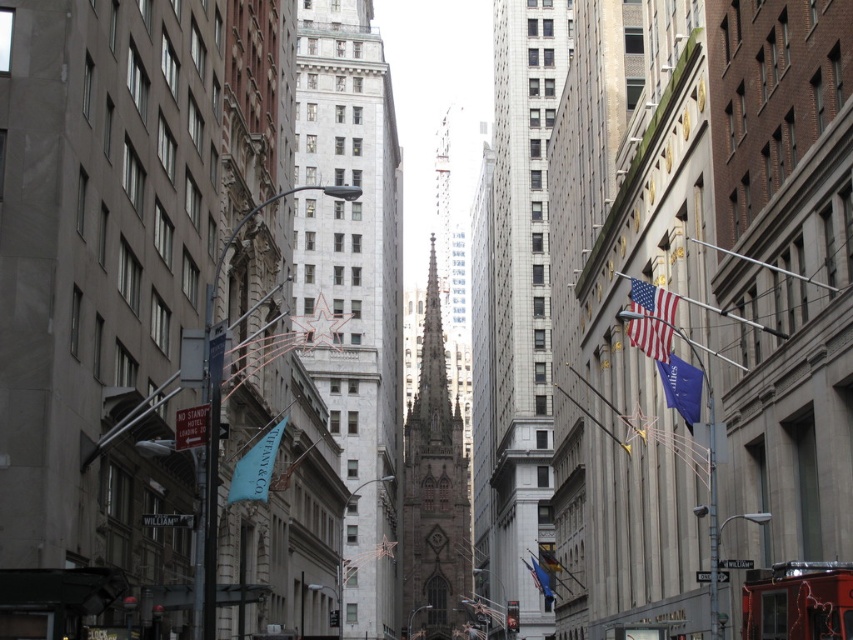
Does brown stone tower at center appear over blue fabric flag at lower center?

Indeed, brown stone tower at center is positioned over blue fabric flag at lower center.

Is brown stone tower at center to the right of blue fabric flag at lower center from the viewer's perspective?

Incorrect, brown stone tower at center is not on the right side of blue fabric flag at lower center.

Find the location of a particular element. Image resolution: width=853 pixels, height=640 pixels. brown stone tower at center is located at coordinates (434, 493).

Locate an element on the screen. This screenshot has width=853, height=640. brown stone tower at center is located at coordinates (434, 493).

Measure the distance between blue fabric flag at lower left and blue fabric flag at right.

blue fabric flag at lower left is 23.07 meters away from blue fabric flag at right.

Between blue fabric flag at lower left and blue fabric flag at right, which one is positioned lower?

blue fabric flag at lower left is lower down.

Is point (228, 486) behind point (654, 362)?

No, (228, 486) is closer to viewer.

What are the coordinates of `blue fabric flag at lower left` in the screenshot? It's located at (254, 467).

Measure the distance between point (537, 422) and camera.

Point (537, 422) and camera are 159.00 meters apart from each other.

Does point (498, 189) come behind point (253, 458)?

Yes.

Identify the location of white tiled tower at center. (521, 292).